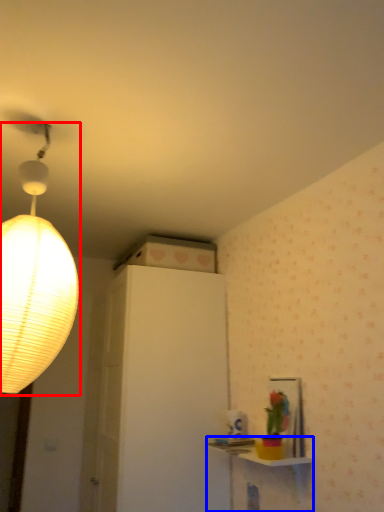
Question: Among these objects, which one is nearest to the camera, lamp (highlighted by a red box) or table (highlighted by a blue box)?

Choices:
 (A) lamp
 (B) table

Answer: (A)